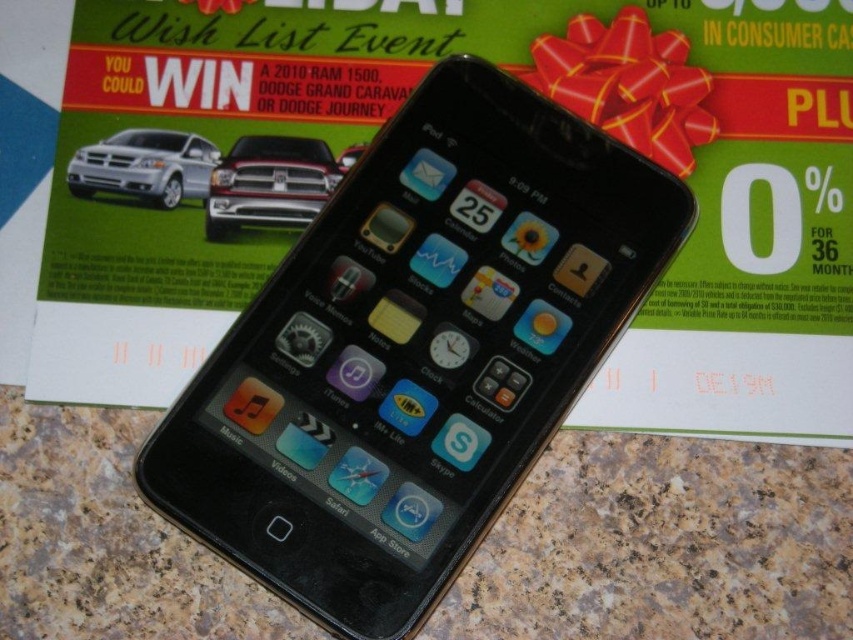
What object is located at the coordinates point (x=268, y=182) in the image?

The object at point (x=268, y=182) is the matte black truck at center.

You are looking at the iPhone screen and see two points marked on it. The first point is at coordinates point (381, 369) and the second is at point (213, 202). Which point is closer to you as you look at the screen?

Point (381, 369) is in front of point (213, 202), so it is closer to you.